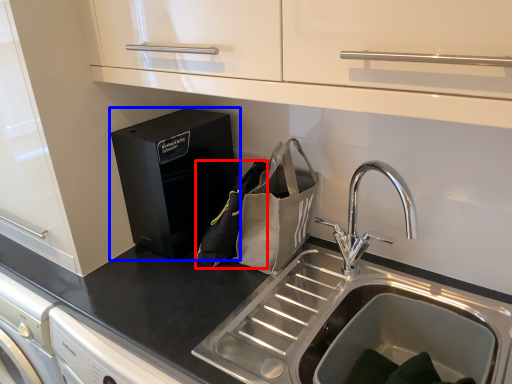
Question: Which point is closer to the camera, pouch (highlighted by a red box) or home appliance (highlighted by a blue box)?

Choices:
 (A) pouch
 (B) home appliance

Answer: (A)